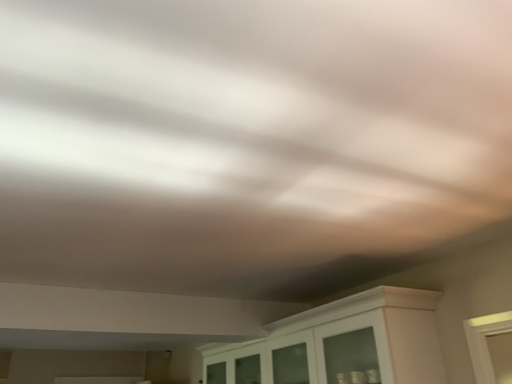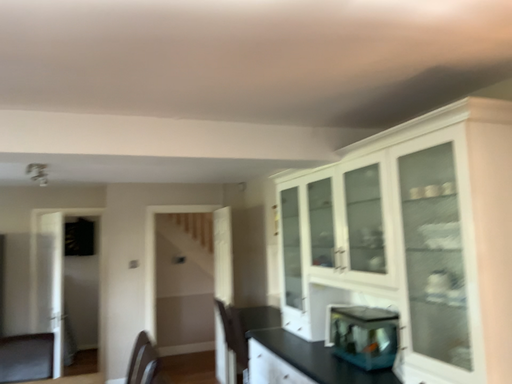
Question: Which way did the camera rotate in the video?

Choices:
 (A) rotated downward
 (B) rotated upward

Answer: (A)